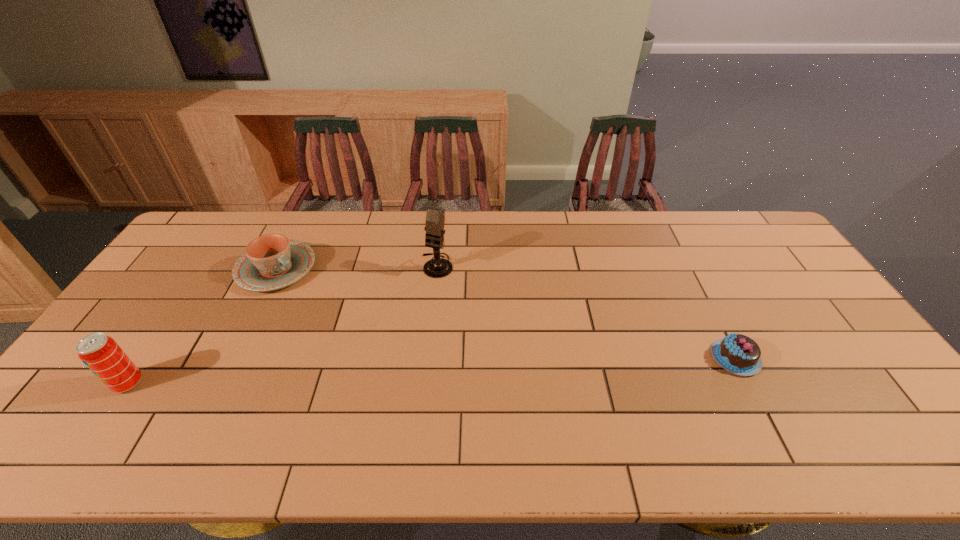
This screenshot has width=960, height=540. I want to click on vacant space at the far edge of the desktop, so click(x=478, y=216).

Locate an element on the screen. This screenshot has width=960, height=540. blank space at the near edge is located at coordinates (589, 388).

Locate an element on the screen. vacant space at the left edge is located at coordinates (171, 333).

In the image, there is a desktop. Identify the location of free space at the far left corner. (224, 233).

Image resolution: width=960 pixels, height=540 pixels. Find the location of `vacant region at the near left corner`. vacant region at the near left corner is located at coordinates (87, 416).

The image size is (960, 540). In the image, there is a desktop. In order to click on free space at the far right corner in this screenshot , I will do `click(743, 218)`.

Locate an element on the screen. The width and height of the screenshot is (960, 540). vacant space at the near right corner of the desktop is located at coordinates (878, 392).

What are the coordinates of `free space between the second object from right to left and the rightmost object` in the screenshot? It's located at click(x=587, y=312).

This screenshot has height=540, width=960. What are the coordinates of `unoccupied position between the third shortest object and the chinaware` in the screenshot? It's located at pos(203,326).

The height and width of the screenshot is (540, 960). I want to click on vacant point located between the leftmost object and the second shortest object, so 203,326.